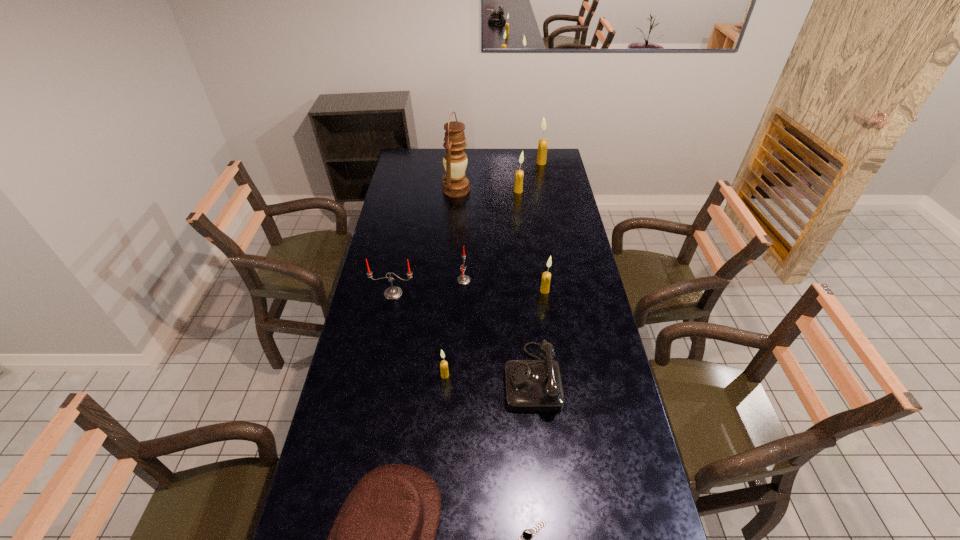
You are a GUI agent. You are given a task and a screenshot of the screen. Output one action in this format:
    pyautogui.click(x=<x>, y=<y>)
    Task: Click on the oil lamp
    
    Given the screenshot: What is the action you would take?
    pyautogui.click(x=455, y=184)

I want to click on the rightmost candle, so click(x=543, y=143).

I want to click on the rightmost object, so coord(543,143).

I want to click on the third tallest object, so click(x=518, y=186).

The image size is (960, 540). I want to click on the third nearest cream candle, so click(x=518, y=186).

The height and width of the screenshot is (540, 960). I want to click on the second nearest cream candle, so click(x=546, y=276).

The height and width of the screenshot is (540, 960). In order to click on the third biggest cream candle in this screenshot , I will do `click(546, 276)`.

At what (x,y) coordinates should I click in order to perform the action: click on the left red candle. Please return your answer as a coordinate pair (x, y). This screenshot has height=540, width=960. Looking at the image, I should click on (393, 292).

At what (x,y) coordinates should I click in order to perform the action: click on the leftmost candle. Please return your answer as a coordinate pair (x, y). Image resolution: width=960 pixels, height=540 pixels. Looking at the image, I should click on (393, 292).

Image resolution: width=960 pixels, height=540 pixels. I want to click on telephone, so click(x=530, y=385).